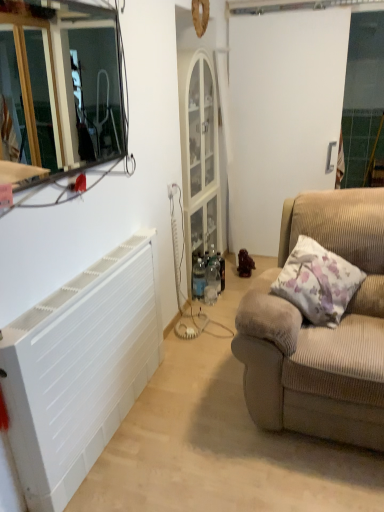
The height and width of the screenshot is (512, 384). What do you see at coordinates (281, 115) in the screenshot?
I see `white matte door at center` at bounding box center [281, 115].

At what (x,y) coordinates should I click in order to perform the action: click on fluffy beige pillow at right. Please return your answer as a coordinate pair (x, y). Looking at the image, I should click on (318, 282).

Measure the distance between fluffy beige pillow at right and camera.

The distance of fluffy beige pillow at right from camera is 6.68 feet.

Where is `white matte door at center`? This screenshot has width=384, height=512. white matte door at center is located at coordinates (281, 115).

Can you confirm if metallic glass window frame at upper left is smaller than white matte door at center?

Indeed, metallic glass window frame at upper left has a smaller size compared to white matte door at center.

Between metallic glass window frame at upper left and white matte door at center, which one appears on the right side from the viewer's perspective?

white matte door at center is more to the right.

The height and width of the screenshot is (512, 384). I want to click on window frame lying below the white matte door at center (from the image's perspective), so click(74, 86).

Is metallic glass window frame at upper left oriented away from white matte door at center?

No.

Are white matte door at center and fluffy beige pillow at right far apart?

Yes, white matte door at center and fluffy beige pillow at right are located far from each other.

Is fluffy beige pillow at right surrounded by white matte door at center?

No, fluffy beige pillow at right is located outside of white matte door at center.

Considering the relative sizes of white matte door at center and fluffy beige pillow at right in the image provided, is white matte door at center smaller than fluffy beige pillow at right?

Actually, white matte door at center might be larger than fluffy beige pillow at right.

Is white matte door at center further to the viewer compared to fluffy beige pillow at right?

Yes.

Is white matte door at center wider than metallic glass window frame at upper left?

Yes, white matte door at center is wider than metallic glass window frame at upper left.

Between point (283, 16) and point (58, 114), which one is positioned in front?

The point (283, 16) is more forward.

Which of these two, white matte door at center or metallic glass window frame at upper left, is bigger?

Bigger between the two is white matte door at center.

How distant is white matte door at center from metallic glass window frame at upper left?

white matte door at center is 1.74 meters from metallic glass window frame at upper left.

From a real-world perspective, is metallic glass window frame at upper left under brown matte figurine at center-right?

Incorrect, from a real-world perspective, metallic glass window frame at upper left is higher than brown matte figurine at center-right.

In the scene shown: Measure the distance between metallic glass window frame at upper left and brown matte figurine at center-right.

The distance of metallic glass window frame at upper left from brown matte figurine at center-right is 2.58 meters.

Is metallic glass window frame at upper left oriented away from brown matte figurine at center-right?

metallic glass window frame at upper left does not have its back to brown matte figurine at center-right.

Is metallic glass window frame at upper left next to brown matte figurine at center-right?

No.

From a real-world perspective, does white plastic radiator at left stand above fluffy beige pillow at right?

No, from a real-world perspective, white plastic radiator at left is not on top of fluffy beige pillow at right.

Consider the image. Based on their positions, is white plastic radiator at left located to the left or right of fluffy beige pillow at right?

white plastic radiator at left is to the left of fluffy beige pillow at right.

Which is in front, white plastic radiator at left or fluffy beige pillow at right?

Positioned in front is white plastic radiator at left.

Are white plastic radiator at left and fluffy beige pillow at right beside each other?

white plastic radiator at left is not next to fluffy beige pillow at right, and they're not touching.

Does white plastic radiator at left appear on the right side of white matte door at center?

Incorrect, white plastic radiator at left is not on the right side of white matte door at center.

Can you confirm if white plastic radiator at left is shorter than white matte door at center?

Indeed, white plastic radiator at left has a lesser height compared to white matte door at center.

Based on the photo, from a real-world perspective, is white plastic radiator at left positioned under white matte door at center based on gravity?

Yes.

Considering the sizes of white plastic radiator at left and white matte door at center in the image, is white plastic radiator at left bigger or smaller than white matte door at center?

white plastic radiator at left is bigger than white matte door at center.

From the image's perspective, who appears lower, white plastic radiator at left or brown matte figurine at center-right?

white plastic radiator at left appears lower in the image.

Where is `toy below the white plastic radiator at left (from a real-world perspective)`? The image size is (384, 512). toy below the white plastic radiator at left (from a real-world perspective) is located at coordinates (245, 264).

Considering the relative positions of white plastic radiator at left and brown matte figurine at center-right in the image provided, is white plastic radiator at left behind brown matte figurine at center-right?

That is False.

Identify the location of window frame below the white matte door at center (from the image's perspective). The width and height of the screenshot is (384, 512). (74, 86).

Find the location of a particular element. This screenshot has width=384, height=512. pillow on the left of the white matte door at center is located at coordinates (318, 282).

Based on their spatial positions, is metallic glass window frame at upper left or brown matte figurine at center-right further from white plastic radiator at left?

The object further to white plastic radiator at left is metallic glass window frame at upper left.

Estimate the real-world distances between objects in this image. Which object is closer to metallic glass window frame at upper left, brown matte figurine at center-right or white matte door at center?

white matte door at center lies closer to metallic glass window frame at upper left than the other object.

Based on the photo, from the image, which object appears to be nearer to beige corduroy couch at right, brown matte figurine at center-right or metallic glass window frame at upper left?

brown matte figurine at center-right.

From the picture: When comparing their distances from fluffy beige pillow at right, does beige corduroy couch at right or white matte door at center seem further?

white matte door at center.

Looking at the image, which one is located closer to beige corduroy couch at right, white matte door at center or brown matte figurine at center-right?

brown matte figurine at center-right lies closer to beige corduroy couch at right than the other object.

In the scene shown: Considering their positions, is white matte door at center positioned further to brown matte figurine at center-right than white plastic radiator at left?

Among the two, white plastic radiator at left is located further to brown matte figurine at center-right.

Which object lies further to the anchor point metallic glass window frame at upper left, beige corduroy couch at right or white matte door at center?

Based on the image, beige corduroy couch at right appears to be further to metallic glass window frame at upper left.

Based on the photo, considering their positions, is fluffy beige pillow at right positioned closer to beige corduroy couch at right than white matte door at center?

fluffy beige pillow at right lies closer to beige corduroy couch at right than the other object.

What are the coordinates of `studio couch positioned between metallic glass window frame at upper left and brown matte figurine at center-right from near to far` in the screenshot? It's located at (320, 330).

I want to click on air conditioning between metallic glass window frame at upper left and white matte door at center in the front-back direction, so click(80, 369).

Locate an element on the screen. Image resolution: width=384 pixels, height=512 pixels. studio couch between white plastic radiator at left and white matte door at center from front to back is located at coordinates (320, 330).

At what (x,y) coordinates should I click in order to perform the action: click on studio couch between white plastic radiator at left and brown matte figurine at center-right along the z-axis. Please return your answer as a coordinate pair (x, y). Looking at the image, I should click on (320, 330).